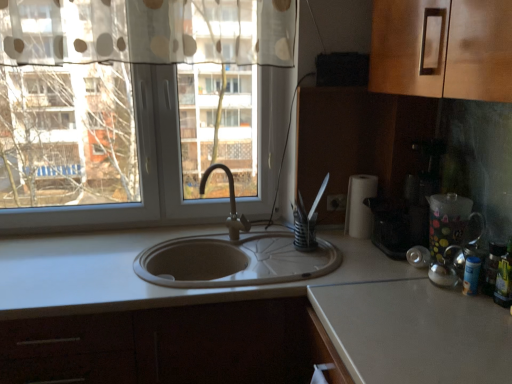
Locate an element on the screen. This screenshot has height=384, width=512. free space in front of white paper towel at right is located at coordinates (364, 253).